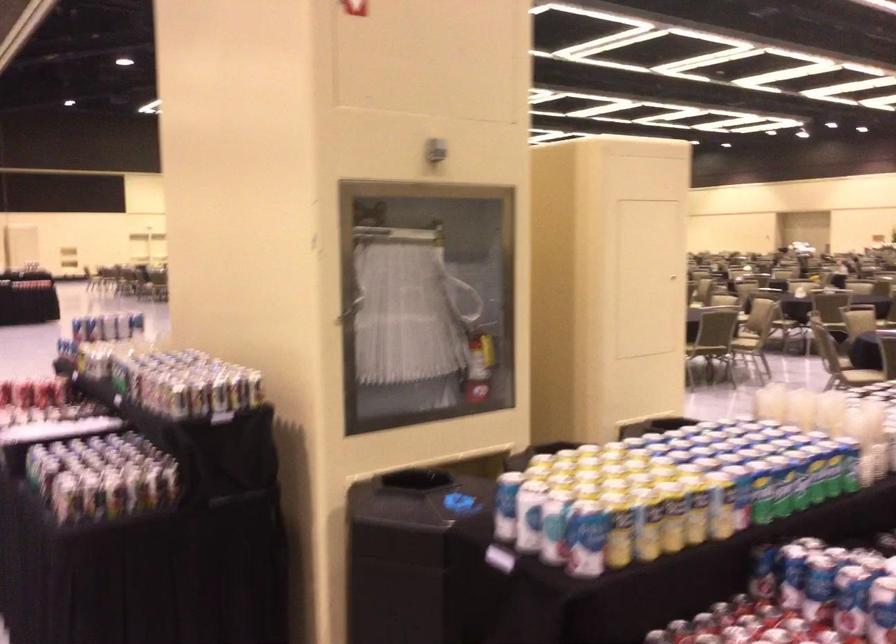
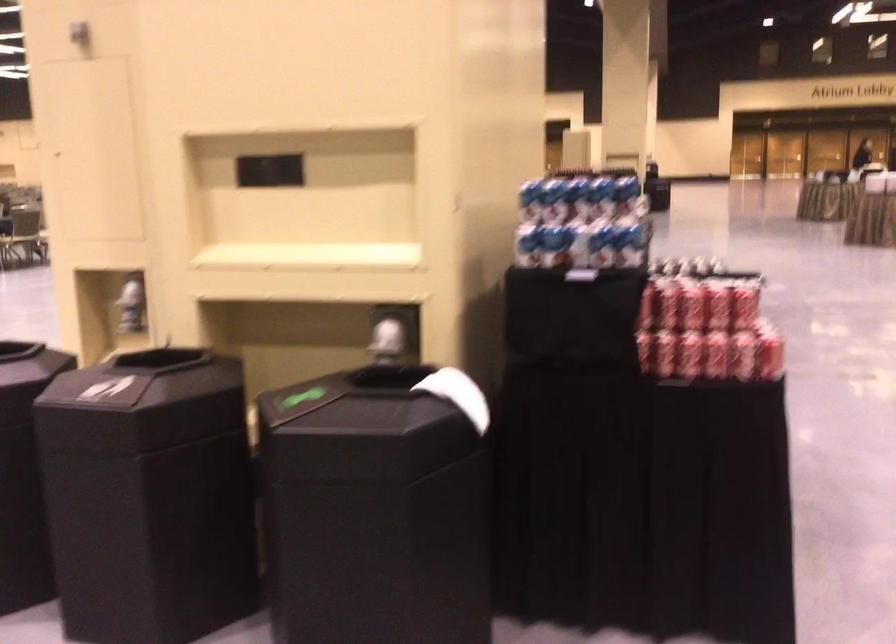
Question: I am providing you with two images of the same scene from different viewpoints. After the viewpoint changes to image2, which objects are now occluded?

Choices:
 (A) dresser drawer lip
 (B) white paper towel
 (C) red soda can
 (D) small beverage bottle

Answer: (D)